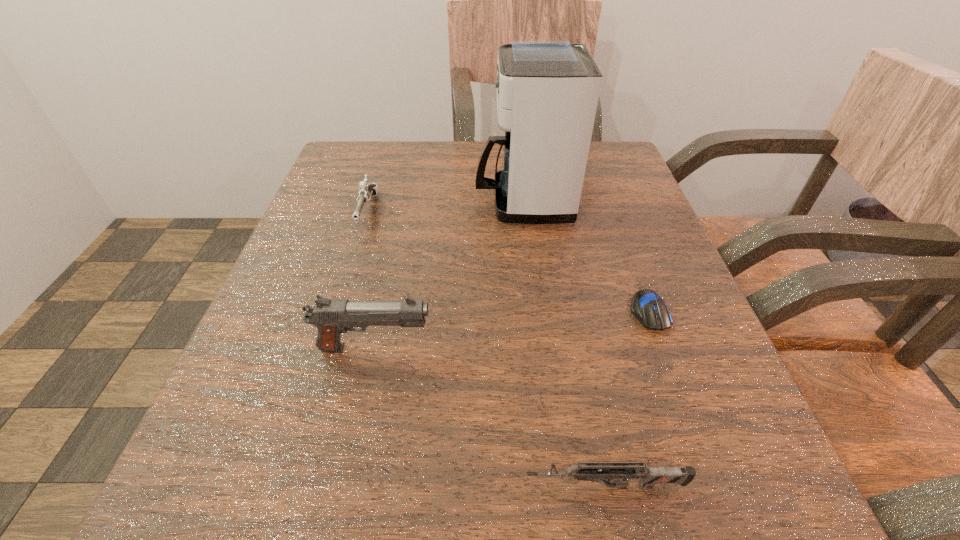
I want to click on free spot between the farthest gun and the second farthest gun, so click(x=372, y=280).

Locate an element on the screen. vacant area between the nearest gun and the tallest object is located at coordinates (564, 343).

This screenshot has width=960, height=540. In order to click on vacant point located between the second nearest object and the nearest gun in this screenshot , I will do `click(490, 417)`.

This screenshot has width=960, height=540. I want to click on object that ranks as the third closest to the farthest gun, so click(x=647, y=306).

Select which object is the closest to the computer mouse. Please provide its 2D coordinates. Your answer should be formatted as a tuple, i.e. [(x, y)], where the tuple contains the x and y coordinates of a point satisfying the conditions above.

[(547, 90)]

Find the location of a particular element. The height and width of the screenshot is (540, 960). gun that is the closest to the rightmost object is located at coordinates (590, 471).

Find the location of a particular element. Image resolution: width=960 pixels, height=540 pixels. gun object that ranks as the closest to the tallest object is located at coordinates (366, 190).